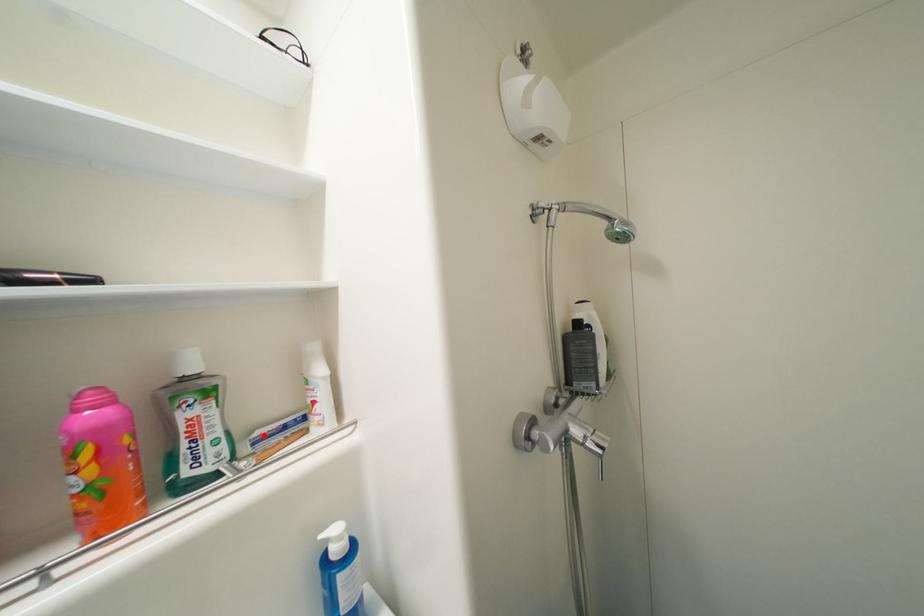
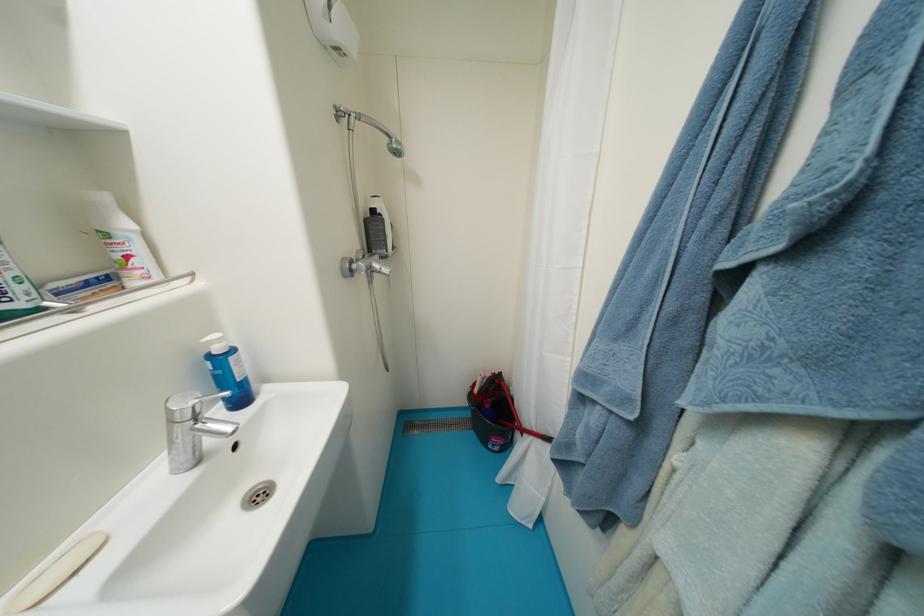
Locate, in the second image, the point that corresponds to the highlighted location in the first image.

(61, 286)